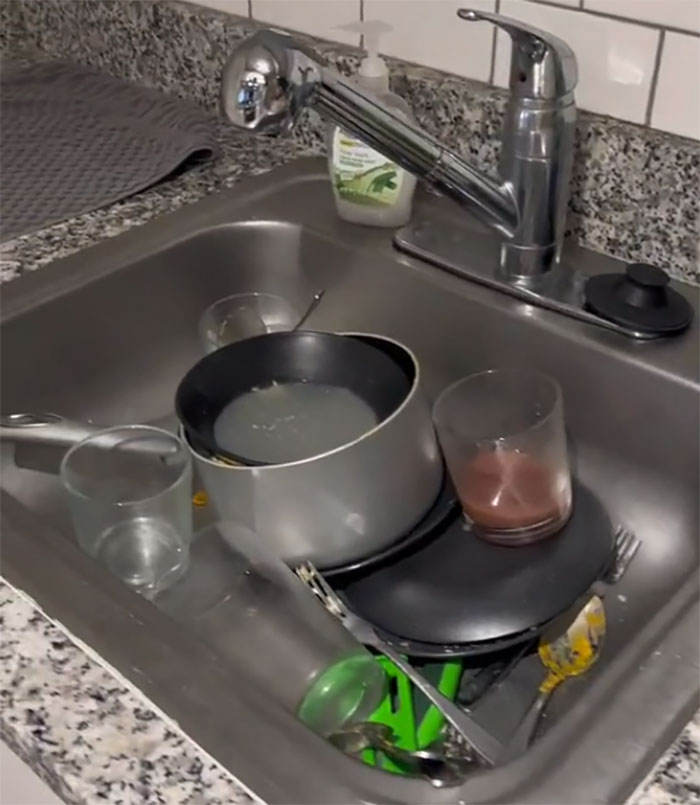
Where is `pot`? The width and height of the screenshot is (700, 805). pot is located at coordinates (332, 493).